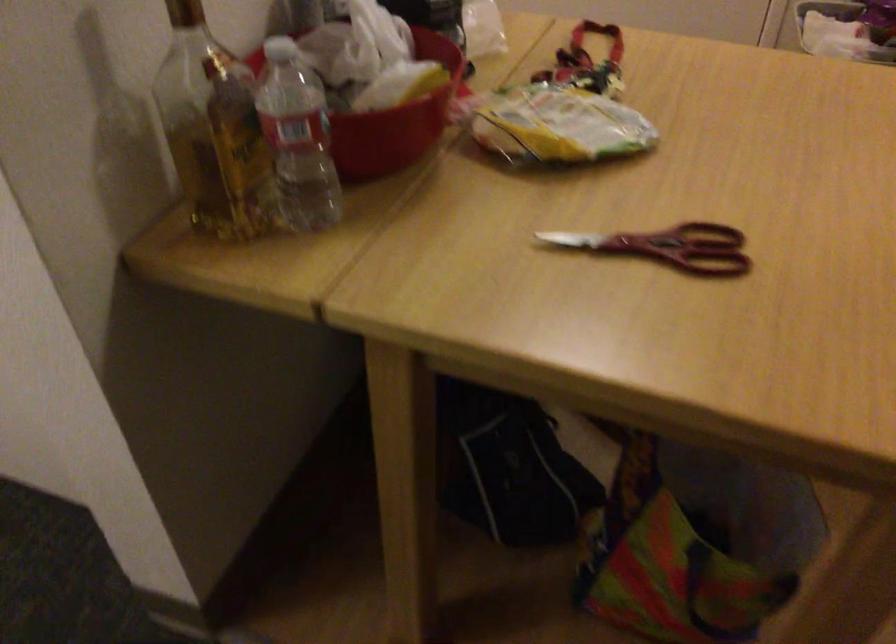
Describe the element at coordinates (558, 125) in the screenshot. The image size is (896, 644). I see `a yellow food package` at that location.